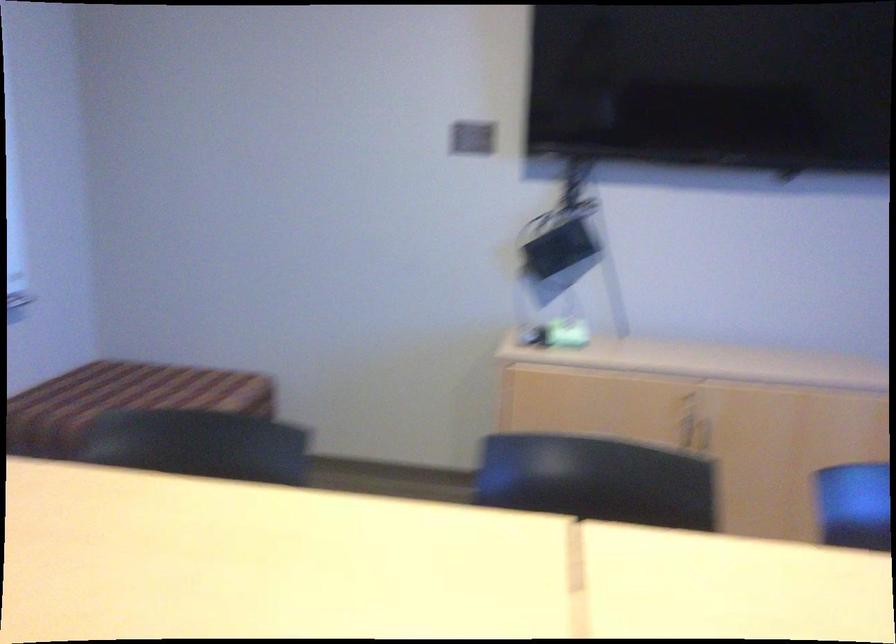
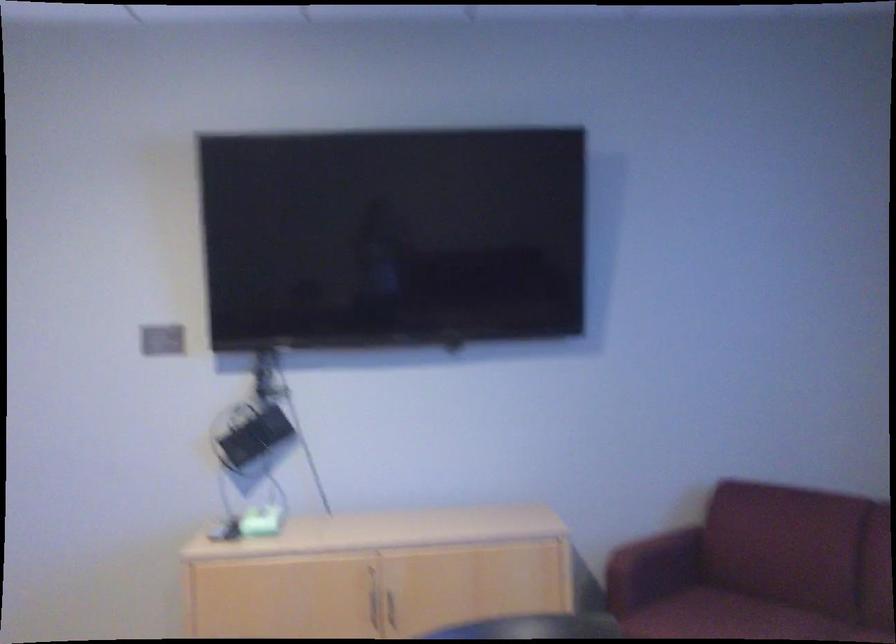
Find the pixel in the second image that matches pixel 563 328 in the first image.

(257, 522)